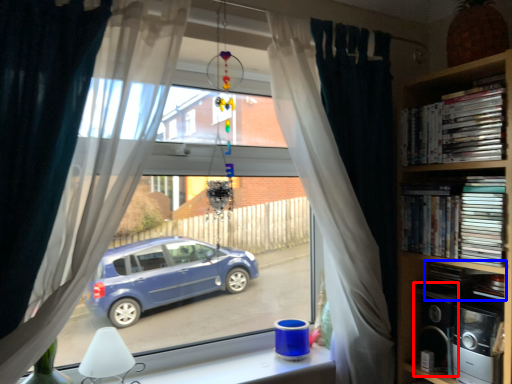
Question: Among these objects, which one is farthest to the camera, appliance (highlighted by a red box) or book (highlighted by a blue box)?

Choices:
 (A) appliance
 (B) book

Answer: (A)